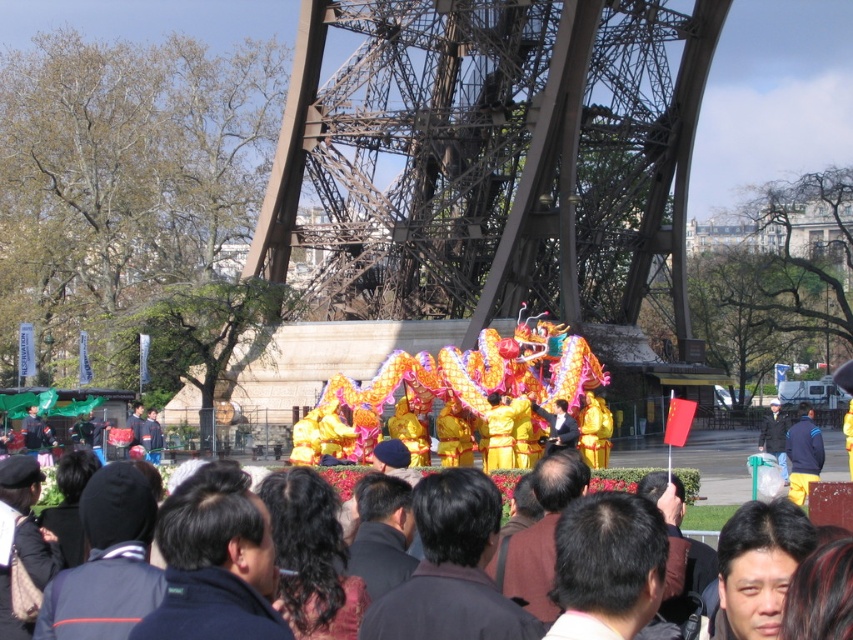
You are a photographer standing at the edge of the crowd. You want to take a photo that includes both the metallic brown eiffel tower at center and the yellow satin dragon at center. Given that your camera has a maximum zoom range of 10 meters, can you capture both subjects in a single frame without moving your position?

The metallic brown eiffel tower at center and yellow satin dragon at center are 21.46 meters apart. Since the camera can only zoom up to 10 meters, you cannot capture both subjects in a single frame without moving your position.

You are a photographer standing at the back of the crowd. You want to capture a photo of the yellow satin dragon at center without the metallic brown eiffel tower at center appearing in the background. Is this possible given their sizes?

The metallic brown eiffel tower at center is taller than the yellow satin dragon at center. Since the Eiffel Tower is taller, it would likely appear in the background of the photo unless the photographer adjusts the angle or zoom to exclude it. However, given their positions at the center, it might be challenging to frame the dragon without including the Eiffel Tower in the shot.

You are standing in the crowd watching the dragon dance performance. Where is the metallic brown eiffel tower at center located relative to your position?

The metallic brown eiffel tower at center is located at coordinates point [492,157] relative to your position.